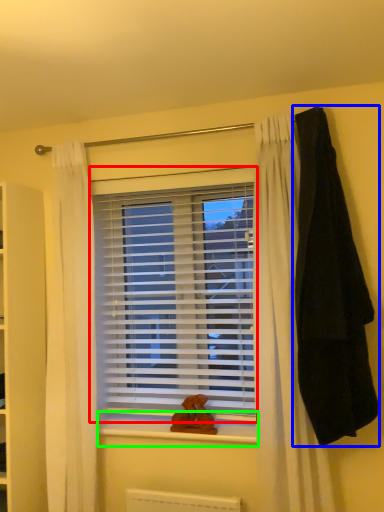
Question: Estimate the real-world distances between objects in this image. Which object is closer to window blind (highlighted by a red box), blanket (highlighted by a blue box) or window sill (highlighted by a green box)?

Choices:
 (A) blanket
 (B) window sill

Answer: (B)